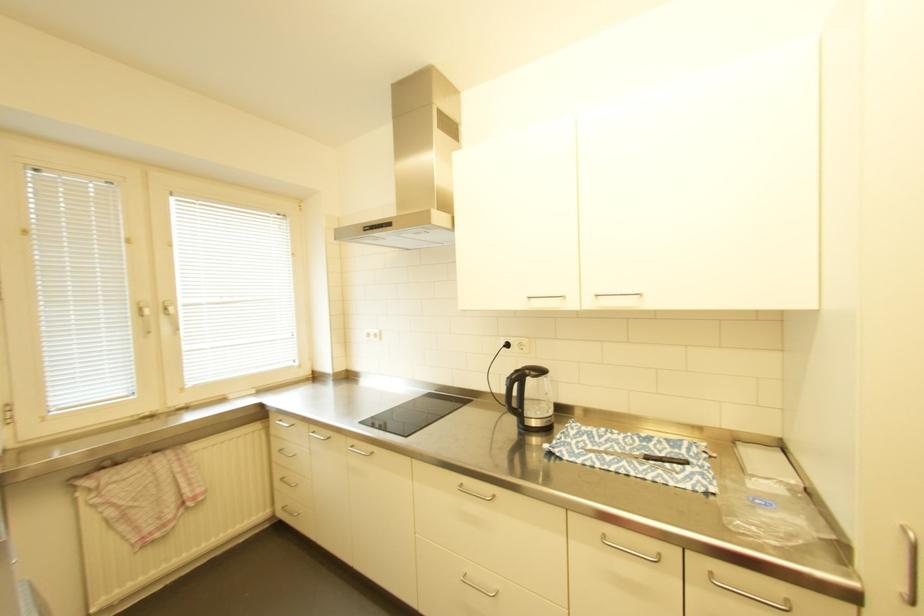
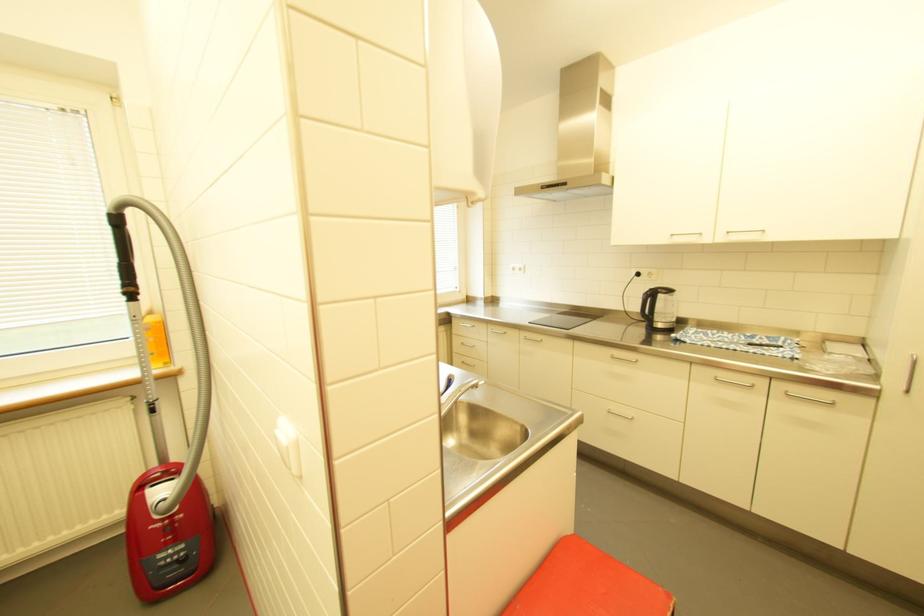
Question: The camera is either moving clockwise (left) or counter-clockwise (right) around the object. The first image is from the beginning of the video and the second image is from the end. Is the camera moving left or right when shooting the video?

Choices:
 (A) Left
 (B) Right

Answer: (B)